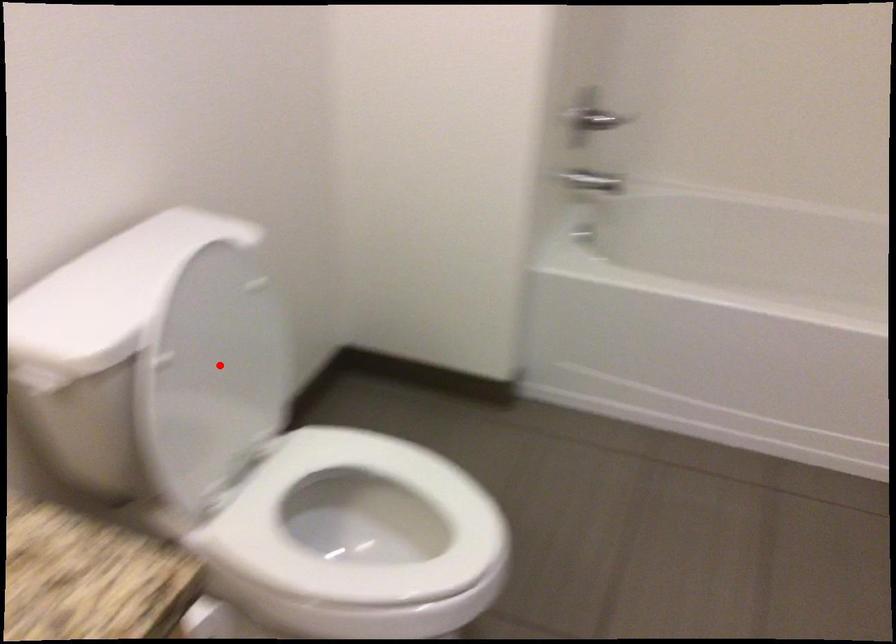
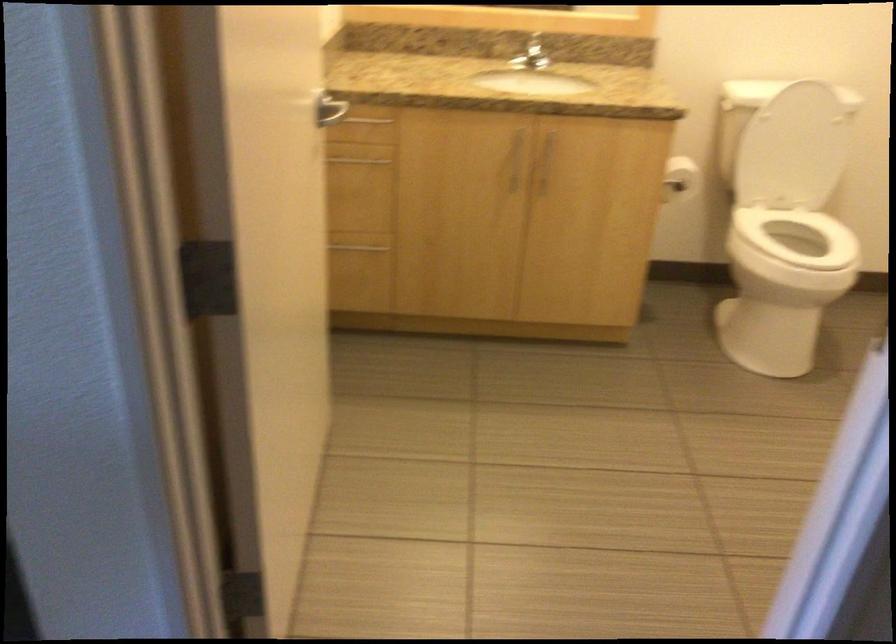
The point at the highlighted location is marked in the first image. Where is the corresponding point in the second image?

(793, 149)